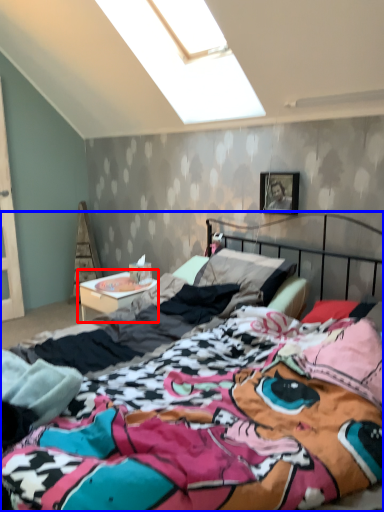
Question: Among these objects, which one is farthest to the camera, nightstand (highlighted by a red box) or bed (highlighted by a blue box)?

Choices:
 (A) nightstand
 (B) bed

Answer: (A)